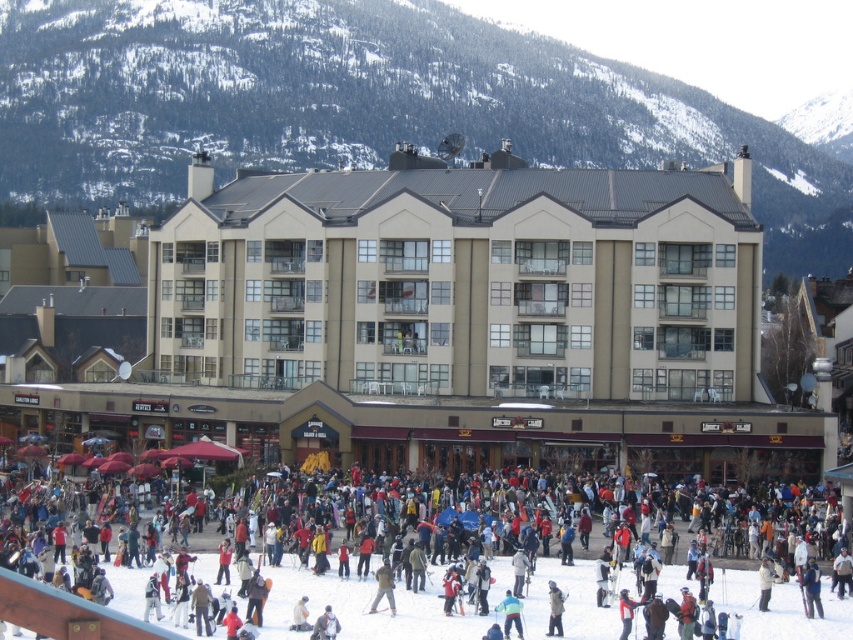
You are a photographer planning to capture a photo of the snowy gray mountain at upper center and the khaki fabric jacket at center. Since you want both subjects to be clearly visible, which one should you focus on first to ensure proper depth of field?

The snowy gray mountain at upper center is taller than the khaki fabric jacket at center, so focusing on the taller snowy gray mountain at upper center first would help ensure both are in focus as it covers a larger portion of the frame.

What are the coordinates of the snowy gray mountain at upper center in the image?

The snowy gray mountain at upper center is located at coordinates point (361,104).